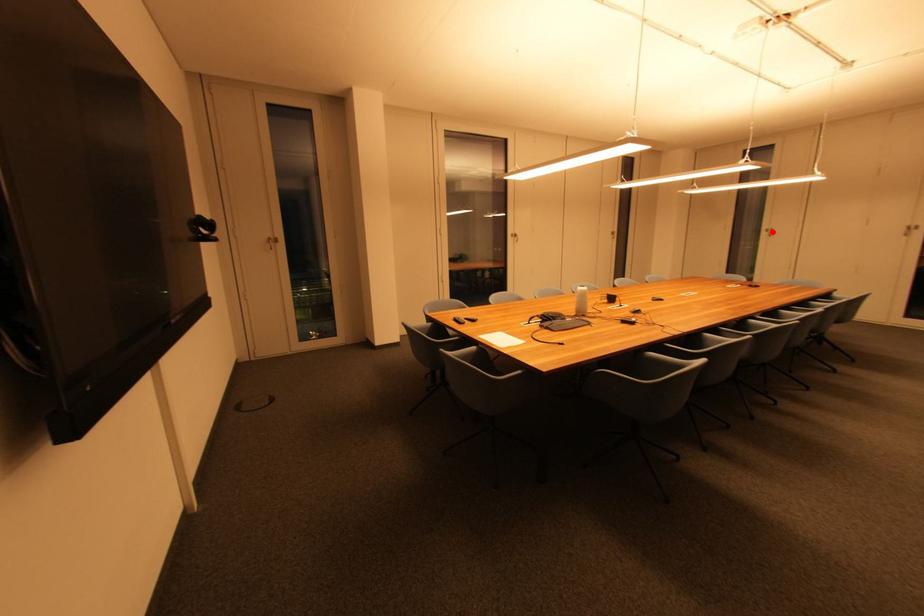
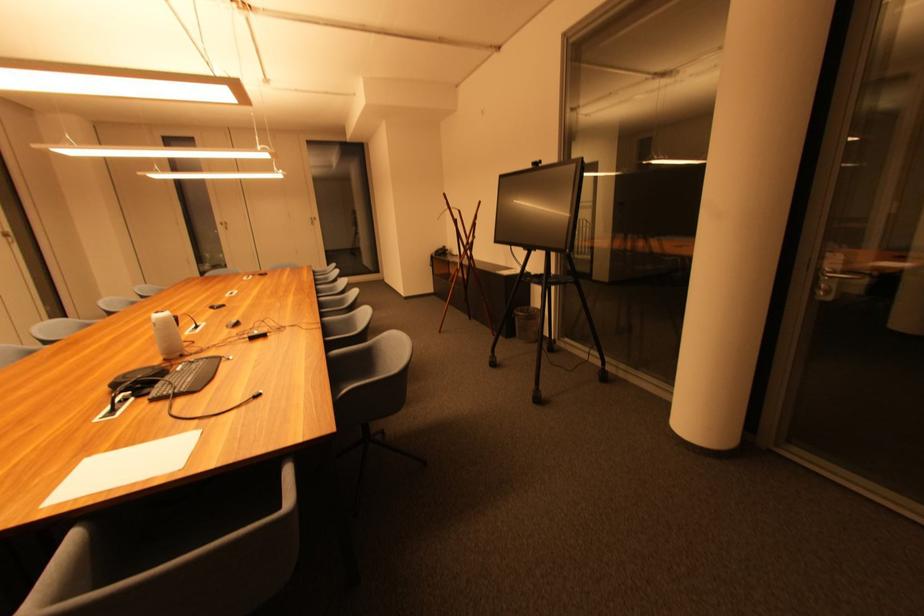
In the second image, find the point that corresponds to the highlighted location in the first image.

(226, 225)